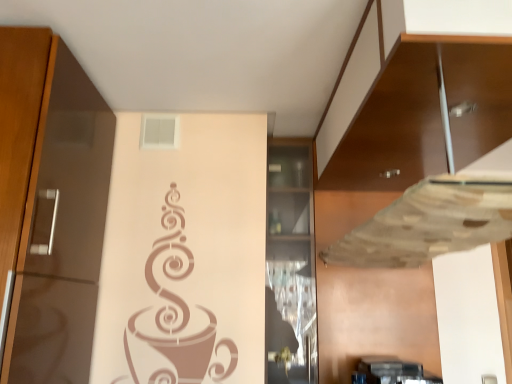
Question: Is transparent glass cabinet at center, which appears as the 2th cabinetry when viewed from the right, located within matte brown cabinet at right, which is the 2th cabinetry from left to right?

Choices:
 (A) no
 (B) yes

Answer: (A)

Question: Is matte brown cabinet at right, which is the 1th cabinetry from right to left, facing away from transparent glass cabinet at center, which appears as the 2th cabinetry when viewed from the right?

Choices:
 (A) yes
 (B) no

Answer: (B)

Question: Considering the relative sizes of matte brown cabinet at right, which is the 1th cabinetry from right to left, and transparent glass cabinet at center, which appears as the 2th cabinetry when viewed from the right, in the image provided, is matte brown cabinet at right, which is the 1th cabinetry from right to left, shorter than transparent glass cabinet at center, which appears as the 2th cabinetry when viewed from the right,?

Choices:
 (A) no
 (B) yes

Answer: (B)

Question: Is matte brown cabinet at right, which is the 1th cabinetry from right to left, further to camera compared to transparent glass cabinet at center, the 1th cabinetry in the left-to-right sequence?

Choices:
 (A) no
 (B) yes

Answer: (A)

Question: Does matte brown cabinet at right, which is the 2th cabinetry from left to right, have a greater width compared to transparent glass cabinet at center, the 1th cabinetry in the left-to-right sequence?

Choices:
 (A) yes
 (B) no

Answer: (A)

Question: From a real-world perspective, is matte brown cabinet at right, which is the 1th cabinetry from right to left, physically below transparent glass cabinet at center, the 1th cabinetry in the left-to-right sequence?

Choices:
 (A) no
 (B) yes

Answer: (A)

Question: Would you say matte brown cabinet at right, which is the 2th cabinetry from left to right, is part of transparent glass cabinet at center, which appears as the 2th cabinetry when viewed from the right,'s contents?

Choices:
 (A) no
 (B) yes

Answer: (A)

Question: Can you confirm if transparent glass cabinet at center, the 1th cabinetry in the left-to-right sequence, is smaller than matte brown cabinet at right, which is the 1th cabinetry from right to left?

Choices:
 (A) no
 (B) yes

Answer: (B)

Question: From a real-world perspective, is transparent glass cabinet at center, which appears as the 2th cabinetry when viewed from the right, on top of matte brown cabinet at right, which is the 1th cabinetry from right to left?

Choices:
 (A) no
 (B) yes

Answer: (A)

Question: Is transparent glass cabinet at center, which appears as the 2th cabinetry when viewed from the right, outside of matte brown cabinet at right, which is the 1th cabinetry from right to left?

Choices:
 (A) no
 (B) yes

Answer: (B)

Question: From the image's perspective, is transparent glass cabinet at center, the 1th cabinetry in the left-to-right sequence, below matte brown cabinet at right, which is the 2th cabinetry from left to right?

Choices:
 (A) no
 (B) yes

Answer: (B)

Question: Is transparent glass cabinet at center, the 1th cabinetry in the left-to-right sequence, shorter than matte brown cabinet at right, which is the 2th cabinetry from left to right?

Choices:
 (A) no
 (B) yes

Answer: (A)

Question: Considering the relative positions of transparent glass cabinet at center, which appears as the 2th cabinetry when viewed from the right, and matte brown cabinet at right, which is the 1th cabinetry from right to left, in the image provided, is transparent glass cabinet at center, which appears as the 2th cabinetry when viewed from the right, to the left or to the right of matte brown cabinet at right, which is the 1th cabinetry from right to left,?

Choices:
 (A) left
 (B) right

Answer: (A)